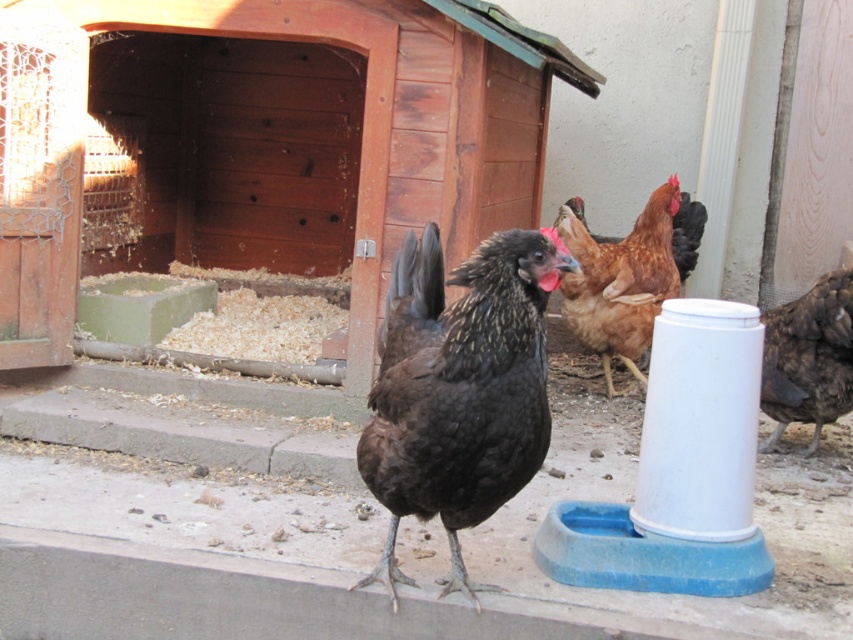
You are a farmer checking the chickens in your coop. You see a brown feathered chicken at center and a shiny black feathers at center. Which chicken is located to the right of the other?

The brown feathered chicken at center is positioned on the right side of shiny black feathers at center, so the brown chicken is to the right of the black one.

You are a chicken farmer checking the coop and the chicken. Which object is closer to you when you are standing in front of the wooden coop at center and the shiny black chicken at center?

The wooden coop at center is closer to you because it is further to the viewer than the shiny black chicken at center, meaning the chicken is actually farther away.

You are standing at the entrance of the wooden chicken coop and want to locate two specific points marked in the image. The first point is at coordinate point (x=653, y=257) and the second is at point (x=408, y=232). Which point is closer to you?

Point (x=408, y=232) is closer to you because it is in front of point (x=653, y=257).